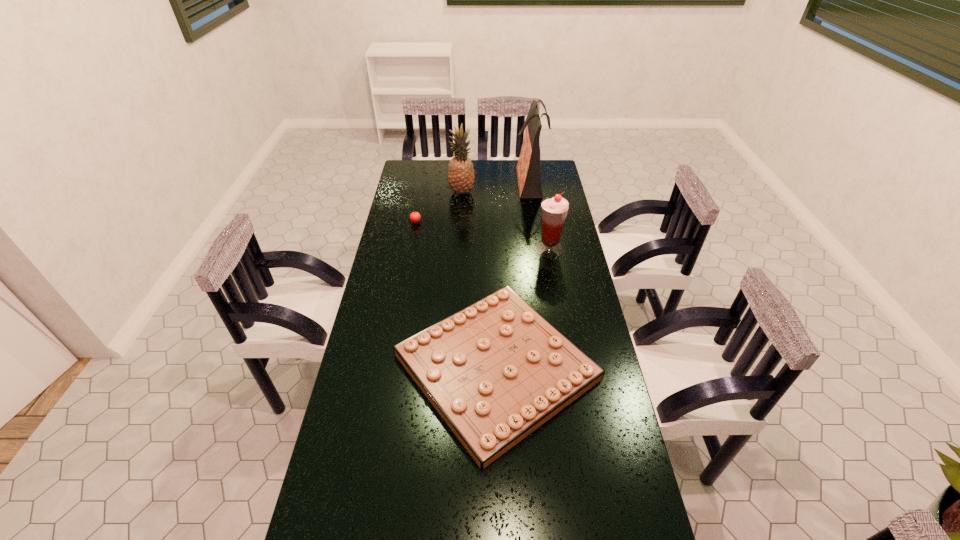
Identify which object is the closest to the shortest object. Please provide its 2D coordinates. Your answer should be formatted as a tuple, i.e. [(x, y)], where the tuple contains the x and y coordinates of a point satisfying the conditions above.

[(554, 210)]

Image resolution: width=960 pixels, height=540 pixels. Find the location of `free region that satisfies the following two spatial constraints: 1. on the front side of the second nearest object; 2. on the left side of the shopping bag`. free region that satisfies the following two spatial constraints: 1. on the front side of the second nearest object; 2. on the left side of the shopping bag is located at coordinates (540, 249).

Identify the location of vacant space that satisfies the following two spatial constraints: 1. on the front side of the shopping bag; 2. on the left side of the third shortest object. (540, 249).